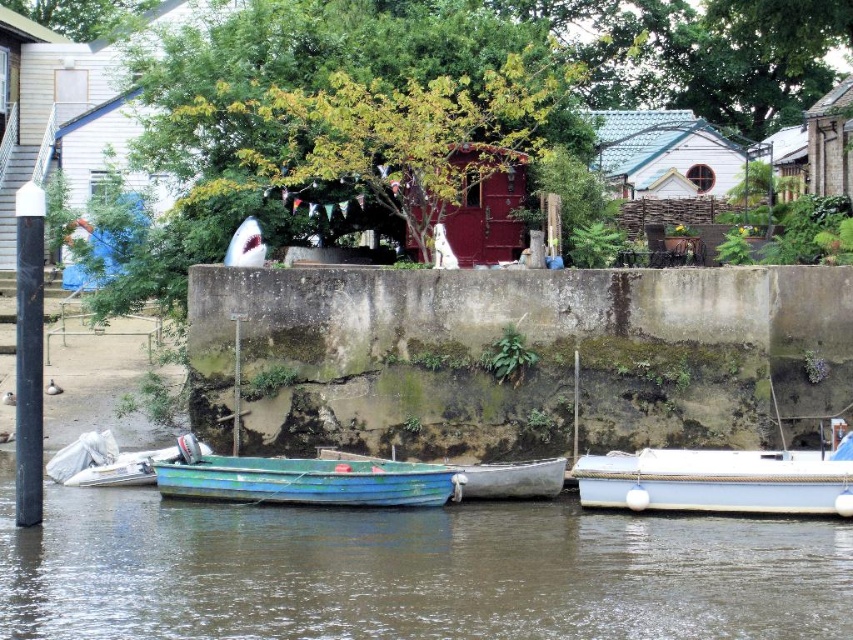
You are standing at the riverside and notice a green matte boat at lower center. Where exactly is this boat positioned in relation to the other objects in the scene?

The green matte boat at lower center is located at point coordinates (x=410, y=572). This places it near the lower central part of the scene, close to the riverbank, as indicated by its coordinates.

You are a visitor standing at the riverside and want to take a photo of the green matte boat at lower center and the white matte hut at upper center. Which object will appear closer to the camera in the photo?

The green matte boat at lower center will appear closer to the camera in the photo because it is positioned in front of the white matte hut at upper center.

You are standing at point (410, 572) in the riverside scene. What object is located exactly at your current position?

The green matte boat at lower center is located exactly at point (410, 572).